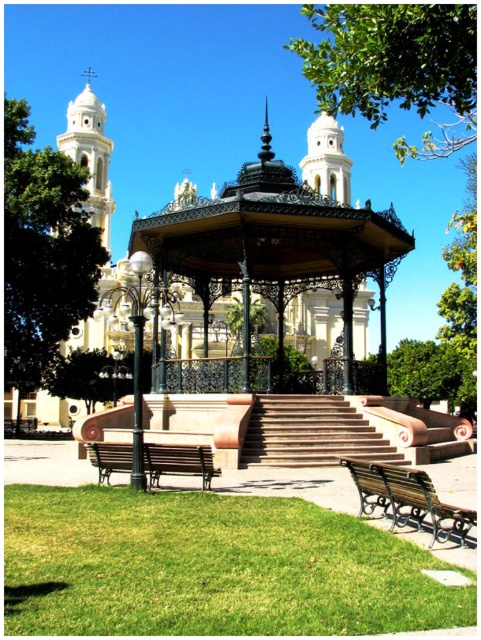
You are a visitor at the park and want to take a photo of the green leafy tree at upper left and the terracotta stone stairs at center. If you stand at the lamppost with multiple spherical lights on the left, which object will appear larger in your photo?

The green leafy tree at upper left will appear larger in the photo because it is much taller than the terracotta stone stairs at center.

You are standing at the bandstand in the image. You want to place a small potted plant exactly at the point marked by the coordinates point (211, 566). What will the plant be placed on?

The point (211, 566) marks green grass at lower center, so the plant will be placed on the green grass at lower center.